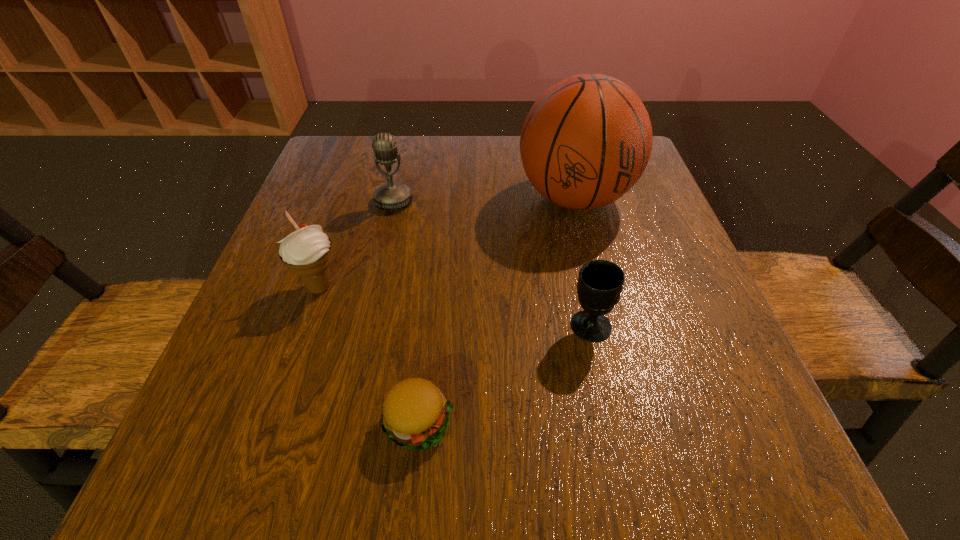
Identify the location of basketball. The height and width of the screenshot is (540, 960). (586, 141).

Locate an element on the screen. The width and height of the screenshot is (960, 540). microphone is located at coordinates (392, 195).

What are the coordinates of `the third nearest object` in the screenshot? It's located at (307, 252).

You are a GUI agent. You are given a task and a screenshot of the screen. Output one action in this format:
    pyautogui.click(x=<x>, y=<y>)
    Task: Click on the leftmost object
    This screenshot has width=960, height=540.
    Given the screenshot: What is the action you would take?
    [307, 252]

The width and height of the screenshot is (960, 540). I want to click on the second shortest object, so click(600, 283).

Image resolution: width=960 pixels, height=540 pixels. I want to click on chalice, so click(x=600, y=283).

Locate an element on the screen. The image size is (960, 540). the third object from right to left is located at coordinates (415, 415).

I want to click on hamburger, so click(415, 415).

Where is `blank area located 0.380m on the front of the tallest object`? The width and height of the screenshot is (960, 540). blank area located 0.380m on the front of the tallest object is located at coordinates (628, 413).

I want to click on vacant space located on the front-facing side of the microphone, so click(x=368, y=316).